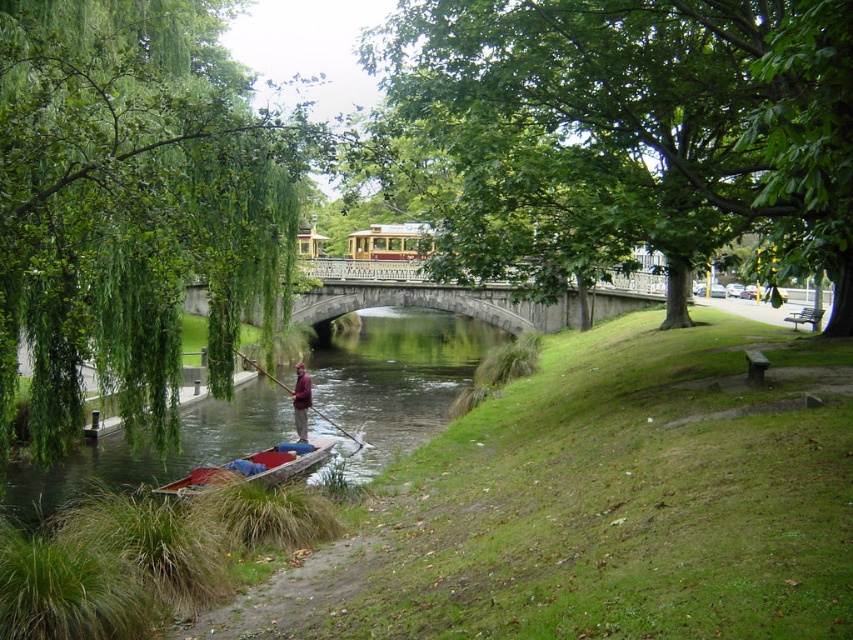
Question: Does green leafy tree at left appear over maroon fabric shirt at center?

Choices:
 (A) yes
 (B) no

Answer: (A)

Question: Which point appears farthest from the camera in this image?

Choices:
 (A) (73, 477)
 (B) (161, 397)

Answer: (A)

Question: Is green leafy tree at left above wooden at center?

Choices:
 (A) yes
 (B) no

Answer: (A)

Question: Is the position of green leafy tree at center more distant than that of brown wooden boat at lower left?

Choices:
 (A) yes
 (B) no

Answer: (B)

Question: Which of the following is the closest to the observer?

Choices:
 (A) (25, 516)
 (B) (113, 349)
 (C) (248, 358)

Answer: (B)

Question: Which object is farther from the camera taking this photo?

Choices:
 (A) brown wooden boat at lower left
 (B) green leafy tree at left
 (C) wooden canoe at lower left
 (D) wooden at center

Answer: (D)